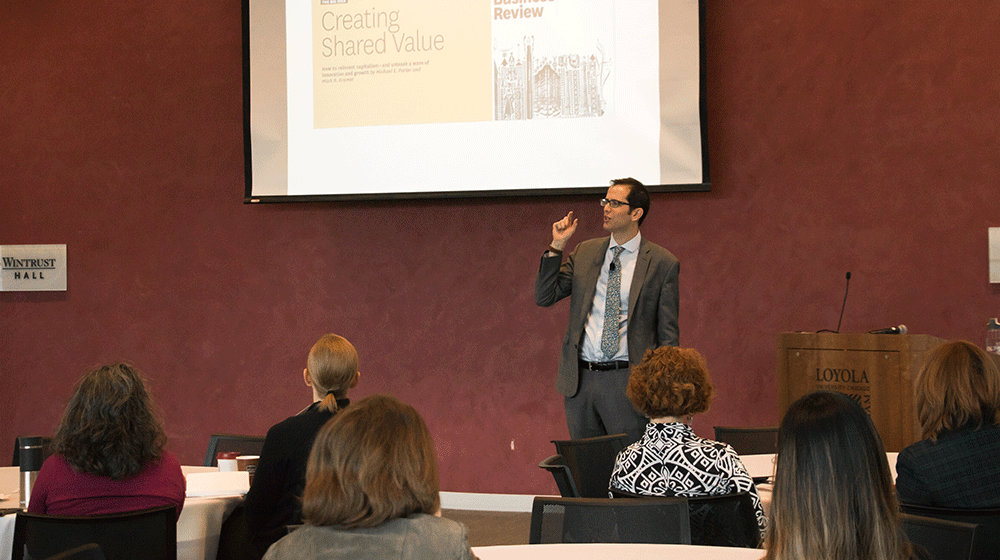
Identify the location of black meshed chair. (121, 547), (245, 442), (627, 519), (586, 460), (752, 438), (939, 526).